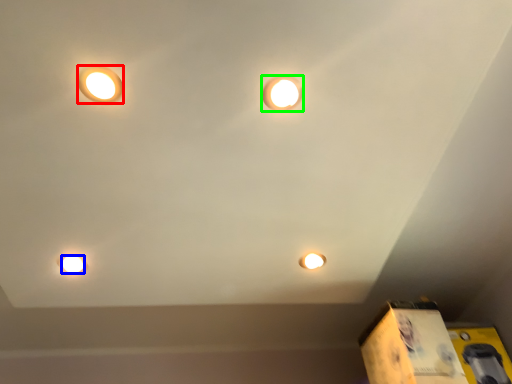
Question: Estimate the real-world distances between objects in this image. Which object is farther from lamp (highlighted by a red box), light bulb (highlighted by a blue box) or lamp (highlighted by a green box)?

Choices:
 (A) light bulb
 (B) lamp

Answer: (A)